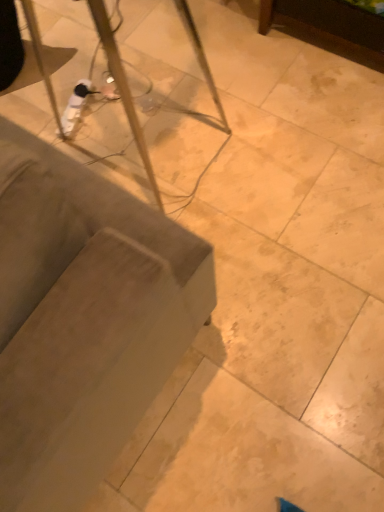
Question: Should I look upward or downward to see clear glass table at upper left?

Choices:
 (A) up
 (B) down

Answer: (B)